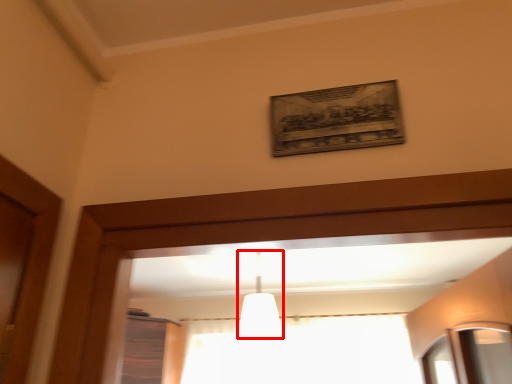
Question: From the image's perspective, considering the relative positions of fixture (annotated by the red box) and curtain in the image provided, where is fixture (annotated by the red box) located with respect to the staircase?

Choices:
 (A) above
 (B) below

Answer: (A)